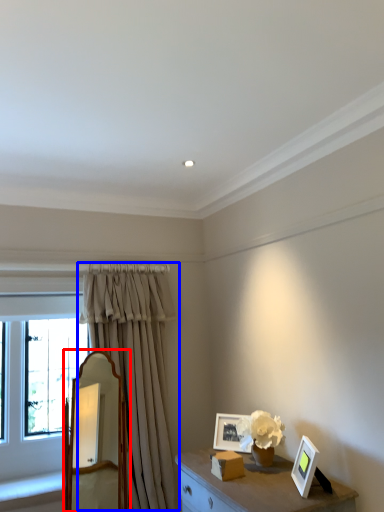
Question: Among these objects, which one is farthest to the camera, mirror (highlighted by a red box) or curtain (highlighted by a blue box)?

Choices:
 (A) mirror
 (B) curtain

Answer: (B)